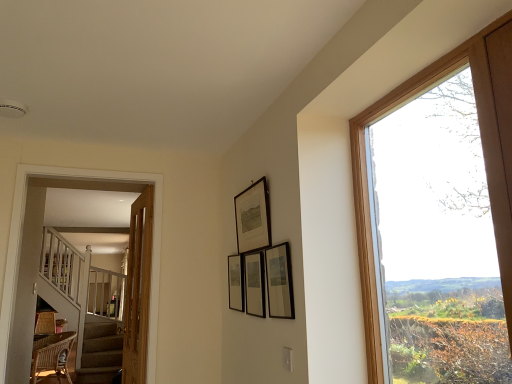
Question: Is matte black picture frame at center, the 3th picture frame viewed from the front, beside wooden door at left?

Choices:
 (A) yes
 (B) no

Answer: (B)

Question: Can you confirm if matte black picture frame at center, the 3th picture frame viewed from the front, is wider than wooden door at left?

Choices:
 (A) yes
 (B) no

Answer: (B)

Question: Does matte black picture frame at center, the 3th picture frame viewed from the front, have a larger size compared to wooden door at left?

Choices:
 (A) no
 (B) yes

Answer: (A)

Question: Is matte black picture frame at center, which appears as the 2th picture frame when viewed from the back, at the right side of wooden door at left?

Choices:
 (A) no
 (B) yes

Answer: (B)

Question: Considering the relative positions of matte black picture frame at center, the 3th picture frame viewed from the front, and wooden door at left in the image provided, is matte black picture frame at center, the 3th picture frame viewed from the front, behind wooden door at left?

Choices:
 (A) no
 (B) yes

Answer: (A)

Question: Is matte black picture frame at center, the 3th picture frame viewed from the front, to the left of wooden door at left from the viewer's perspective?

Choices:
 (A) yes
 (B) no

Answer: (B)

Question: Does wooden framed print at upper center, which appears as the 2th picture frame when viewed from the front, have a greater height compared to white wooden staircase at left?

Choices:
 (A) yes
 (B) no

Answer: (B)

Question: Does wooden framed print at upper center, which appears as the 2th picture frame when viewed from the front, have a lesser width compared to white wooden staircase at left?

Choices:
 (A) no
 (B) yes

Answer: (B)

Question: Is wooden framed print at upper center, which appears as the 2th picture frame when viewed from the front, to the right of white wooden staircase at left from the viewer's perspective?

Choices:
 (A) no
 (B) yes

Answer: (B)

Question: From a real-world perspective, is wooden framed print at upper center, which appears as the 2th picture frame when viewed from the front, physically below white wooden staircase at left?

Choices:
 (A) no
 (B) yes

Answer: (A)

Question: From the image's perspective, is wooden framed print at upper center, arranged as the third picture frame when viewed from the back, on white wooden staircase at left?

Choices:
 (A) no
 (B) yes

Answer: (B)

Question: Is wooden framed print at upper center, arranged as the third picture frame when viewed from the back, bigger than white wooden staircase at left?

Choices:
 (A) no
 (B) yes

Answer: (A)

Question: Could you tell me if white wooden staircase at left is facing wooden framed print at upper center, arranged as the third picture frame when viewed from the back?

Choices:
 (A) no
 (B) yes

Answer: (A)